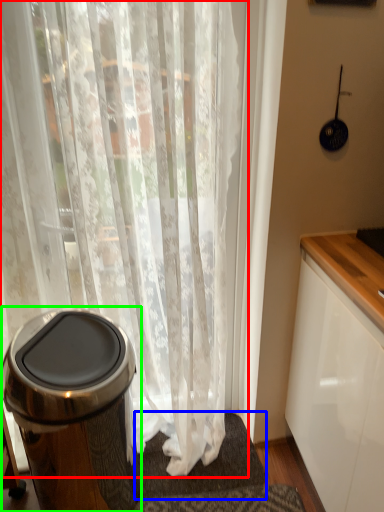
Question: Based on their relative distances, which object is nearer to curtain (highlighted by a red box)? Choose from bath mat (highlighted by a blue box) and waste container (highlighted by a green box).

Choices:
 (A) bath mat
 (B) waste container

Answer: (B)